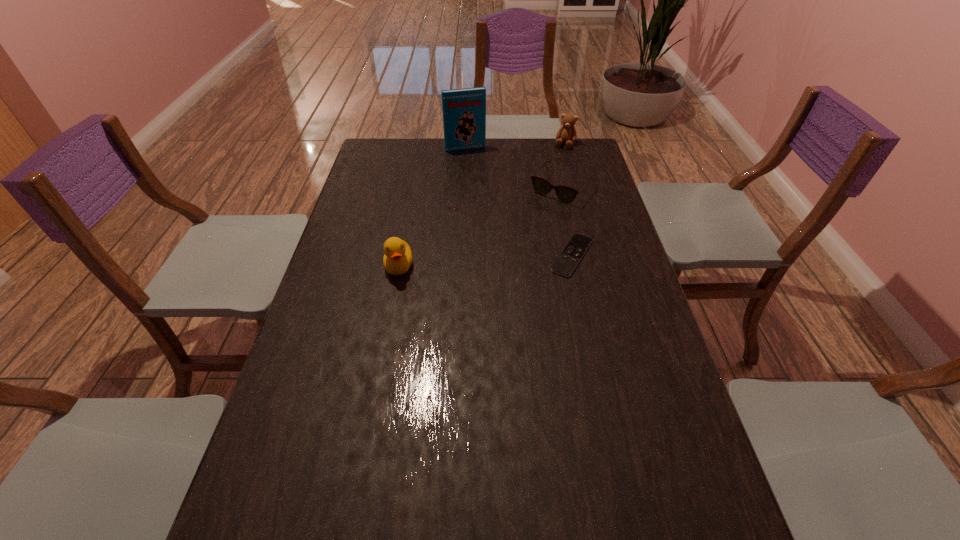
Identify the location of vacant point that satisfies the following two spatial constraints: 1. on the back side of the teddy bear; 2. on the right side of the third farthest object. (551, 144).

Where is `vacant area that satisfies the following two spatial constraints: 1. on the back side of the teddy bear; 2. on the left side of the book`? The image size is (960, 540). vacant area that satisfies the following two spatial constraints: 1. on the back side of the teddy bear; 2. on the left side of the book is located at coordinates (466, 144).